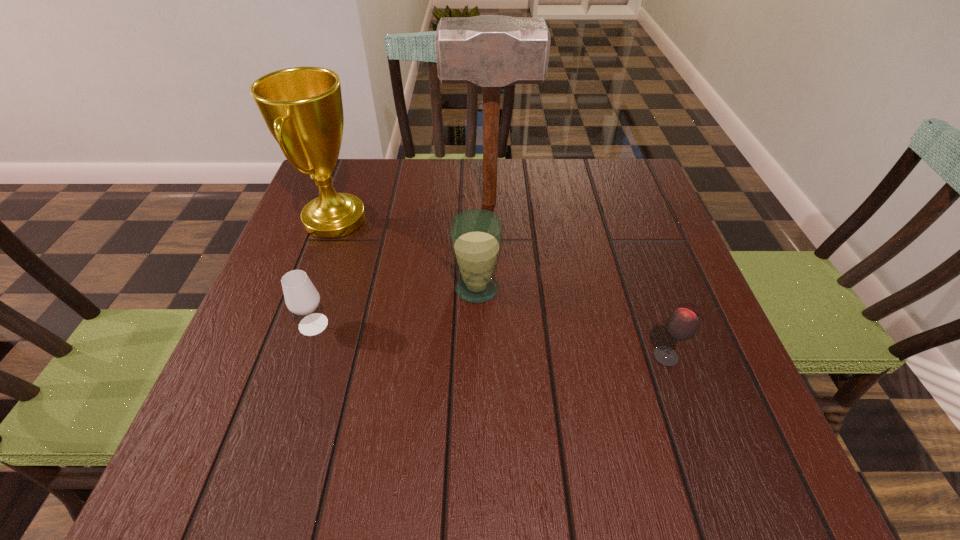
In order to click on vacant space that satisfies the following two spatial constraints: 1. by the handles of the second nearest object; 2. on the left side of the award in this screenshot , I will do `click(297, 325)`.

The image size is (960, 540). I want to click on free space that satisfies the following two spatial constraints: 1. on the back side of the second glass from right to left; 2. by the handles of the award, so click(x=477, y=220).

At what (x,y) coordinates should I click in order to perform the action: click on vacant space that satisfies the following two spatial constraints: 1. by the handles of the award; 2. on the back side of the third nearest object. Please return your answer as a coordinate pair (x, y). Looking at the image, I should click on (310, 289).

Find the location of a particular element. This screenshot has width=960, height=540. vacant position in the image that satisfies the following two spatial constraints: 1. by the handles of the award; 2. on the left side of the nearest glass is located at coordinates (285, 357).

Find the location of a particular element. The height and width of the screenshot is (540, 960). free point that satisfies the following two spatial constraints: 1. on the striking face of the mallet; 2. on the left side of the rightmost glass is located at coordinates pyautogui.click(x=493, y=357).

Where is `vacant point that satisfies the following two spatial constraints: 1. on the striking face of the mallet; 2. on the right side of the rightmost object`? The height and width of the screenshot is (540, 960). vacant point that satisfies the following two spatial constraints: 1. on the striking face of the mallet; 2. on the right side of the rightmost object is located at coordinates (493, 357).

Locate an element on the screen. This screenshot has height=540, width=960. free spot that satisfies the following two spatial constraints: 1. on the striking face of the tallest object; 2. on the left side of the nearest glass is located at coordinates (493, 357).

What are the coordinates of `vacant region that satisfies the following two spatial constraints: 1. on the back side of the leftmost glass; 2. by the handles of the award` in the screenshot? It's located at (348, 220).